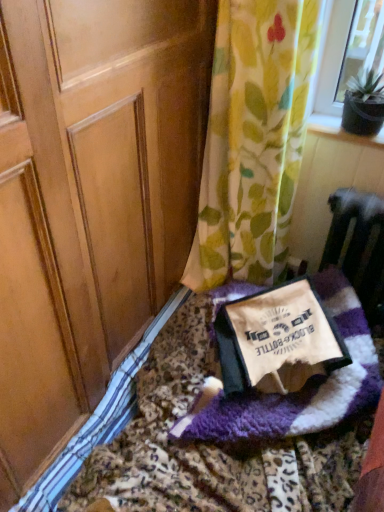
In order to face purple fuzzy blanket at lower right, should I rotate leftwards or rightwards?

A 6.815 degree turn to the right will do.

The image size is (384, 512). Identify the location of purple fuzzy blanket at lower right. (207, 444).

Can you confirm if beige fleece blanket at center is wider than floral fabric curtain at upper right?

Yes.

Considering their positions, is beige fleece blanket at center located in front of or behind floral fabric curtain at upper right?

beige fleece blanket at center is positioned farther from the viewer than floral fabric curtain at upper right.

Can you tell me how much beige fleece blanket at center and floral fabric curtain at upper right differ in facing direction?

The angular difference between beige fleece blanket at center and floral fabric curtain at upper right is 43.1 degrees.

Based on the photo, is beige fleece blanket at center positioned beyond the bounds of floral fabric curtain at upper right?

That's correct, beige fleece blanket at center is outside of floral fabric curtain at upper right.

Is floral fabric curtain at upper right facing towards purple fuzzy blanket at lower right?

No, floral fabric curtain at upper right does not turn towards purple fuzzy blanket at lower right.

Considering the sizes of objects floral fabric curtain at upper right and purple fuzzy blanket at lower right in the image provided, who is bigger, floral fabric curtain at upper right or purple fuzzy blanket at lower right?

floral fabric curtain at upper right.

Considering the relative positions of floral fabric curtain at upper right and purple fuzzy blanket at lower right in the image provided, is floral fabric curtain at upper right to the left or to the right of purple fuzzy blanket at lower right?

In the image, floral fabric curtain at upper right appears on the right side of purple fuzzy blanket at lower right.

How many degrees apart are the facing directions of floral fabric curtain at upper right and purple fuzzy blanket at lower right?

The facing directions of floral fabric curtain at upper right and purple fuzzy blanket at lower right are 2.62 degrees apart.

Is purple fuzzy blanket at lower right turned away from floral fabric curtain at upper right?

purple fuzzy blanket at lower right does not have its back to floral fabric curtain at upper right.

Is purple fuzzy blanket at lower right in front of or behind floral fabric curtain at upper right in the image?

Clearly, purple fuzzy blanket at lower right is in front of floral fabric curtain at upper right.

The image size is (384, 512). I want to click on curtain on the right of purple fuzzy blanket at lower right, so point(253,139).

Can you confirm if purple fuzzy blanket at lower right is positioned to the left of floral fabric curtain at upper right?

Indeed, purple fuzzy blanket at lower right is positioned on the left side of floral fabric curtain at upper right.

Is purple fuzzy blanket at lower right not inside beige fleece blanket at center?

Indeed, purple fuzzy blanket at lower right is completely outside beige fleece blanket at center.

Consider the image. Considering the sizes of objects purple fuzzy blanket at lower right and beige fleece blanket at center in the image provided, who is smaller, purple fuzzy blanket at lower right or beige fleece blanket at center?

beige fleece blanket at center.

From a real-world perspective, between purple fuzzy blanket at lower right and beige fleece blanket at center, who is vertically higher?

In real-world perspective, beige fleece blanket at center is above.

Consider the image. Does purple fuzzy blanket at lower right come behind beige fleece blanket at center?

No, purple fuzzy blanket at lower right is closer to the camera.

Could purple fuzzy blanket at lower right be considered to be inside beige fleece blanket at center?

Definitely not — purple fuzzy blanket at lower right is not inside beige fleece blanket at center.

Measure the distance between beige fleece blanket at center and purple fuzzy blanket at lower right.

beige fleece blanket at center and purple fuzzy blanket at lower right are 10.64 centimeters apart from each other.

Which object is positioned more to the left, beige fleece blanket at center or purple fuzzy blanket at lower right?

purple fuzzy blanket at lower right.

The image size is (384, 512). Identify the location of bedding below the beige fleece blanket at center (from a real-world perspective). coord(207,444).

Do you think floral fabric curtain at upper right is within beige fleece blanket at center, or outside of it?

floral fabric curtain at upper right is located beyond the bounds of beige fleece blanket at center.

Looking at this image, based on their sizes in the image, would you say floral fabric curtain at upper right is bigger or smaller than beige fleece blanket at center?

Considering their sizes, floral fabric curtain at upper right takes up more space than beige fleece blanket at center.

Is beige fleece blanket at center at the back of floral fabric curtain at upper right?

floral fabric curtain at upper right is not turned away from beige fleece blanket at center.

Locate an element on the screen. This screenshot has width=384, height=512. blanket that appears below the floral fabric curtain at upper right (from a real-world perspective) is located at coordinates (305, 385).

Identify the location of curtain located behind the purple fuzzy blanket at lower right. The width and height of the screenshot is (384, 512). (253, 139).

When comparing their distances from floral fabric curtain at upper right, does purple fuzzy blanket at lower right or beige fleece blanket at center seem further?

purple fuzzy blanket at lower right is further to floral fabric curtain at upper right.

Based on their spatial positions, is beige fleece blanket at center or floral fabric curtain at upper right further from purple fuzzy blanket at lower right?

floral fabric curtain at upper right lies further to purple fuzzy blanket at lower right than the other object.

Estimate the real-world distances between objects in this image. Which object is further from beige fleece blanket at center, floral fabric curtain at upper right or purple fuzzy blanket at lower right?

Based on the image, floral fabric curtain at upper right appears to be further to beige fleece blanket at center.

Considering their positions, is purple fuzzy blanket at lower right positioned further to beige fleece blanket at center than floral fabric curtain at upper right?

Based on the image, floral fabric curtain at upper right appears to be further to beige fleece blanket at center.

When comparing their distances from floral fabric curtain at upper right, does beige fleece blanket at center or purple fuzzy blanket at lower right seem further?

Based on the image, purple fuzzy blanket at lower right appears to be further to floral fabric curtain at upper right.

When comparing their distances from purple fuzzy blanket at lower right, does floral fabric curtain at upper right or beige fleece blanket at center seem closer?

beige fleece blanket at center is positioned closer to the anchor purple fuzzy blanket at lower right.

Identify the location of blanket between floral fabric curtain at upper right and purple fuzzy blanket at lower right in the vertical direction. The width and height of the screenshot is (384, 512). (305, 385).